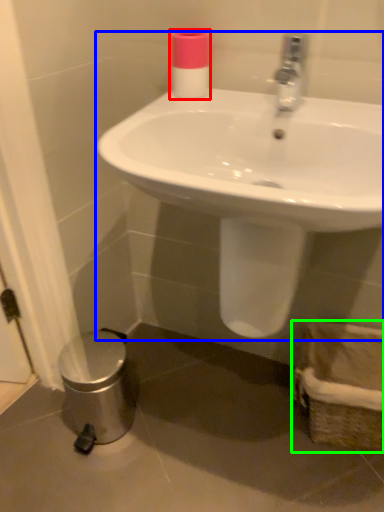
Question: Estimate the real-world distances between objects in this image. Which object is farther from toiletry (highlighted by a red box), sink (highlighted by a blue box) or basket (highlighted by a green box)?

Choices:
 (A) sink
 (B) basket

Answer: (B)